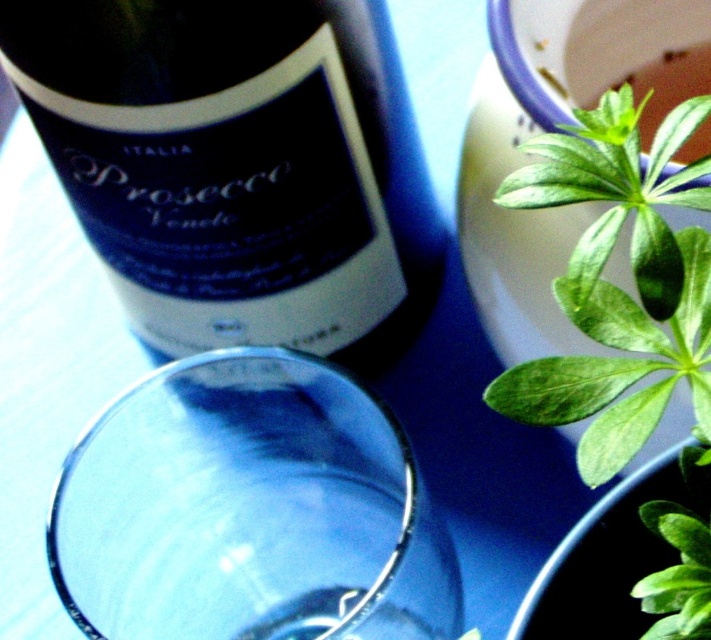
Who is lower down, matte black bottle at upper left or green glossy leaf at upper right?

green glossy leaf at upper right

Image resolution: width=711 pixels, height=640 pixels. Describe the element at coordinates (237, 81) in the screenshot. I see `matte black bottle at upper left` at that location.

Between point (282, 8) and point (646, 269), which one is positioned behind?

The point (282, 8) is behind.

You are a GUI agent. You are given a task and a screenshot of the screen. Output one action in this format:
    pyautogui.click(x=<x>, y=<y>)
    Task: Click on the matte black bottle at upper left
    
    Given the screenshot: What is the action you would take?
    pyautogui.click(x=237, y=81)

Is transparent glass at center below green glossy leaf at upper right?

Yes.

Can you confirm if transparent glass at center is taller than green glossy leaf at upper right?

Indeed, transparent glass at center has a greater height compared to green glossy leaf at upper right.

Find the location of a particular element. transparent glass at center is located at coordinates (250, 509).

Measure the distance between point (109, 412) and camera.

The distance of point (109, 412) from camera is 15.54 inches.

Can you confirm if transparent glass at center is thinner than matte black bottle at upper left?

Correct, transparent glass at center's width is less than matte black bottle at upper left's.

Measure the distance between transparent glass at center and camera.

32.52 centimeters

You are a GUI agent. You are given a task and a screenshot of the screen. Output one action in this format:
    pyautogui.click(x=<x>, y=<y>)
    Task: Click on the transparent glass at center
    
    Given the screenshot: What is the action you would take?
    pyautogui.click(x=250, y=509)